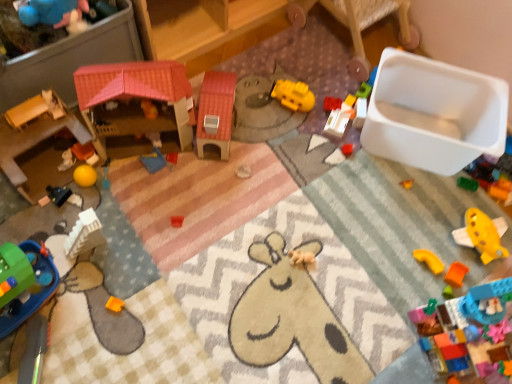
Locate an element on the screen. vacant area that lies between yellow plastic block at upper center, which appears as the 11th toy when viewed from the left, and blue plastic tray at center, acting as the 6th toy starting from the left is located at coordinates (259, 135).